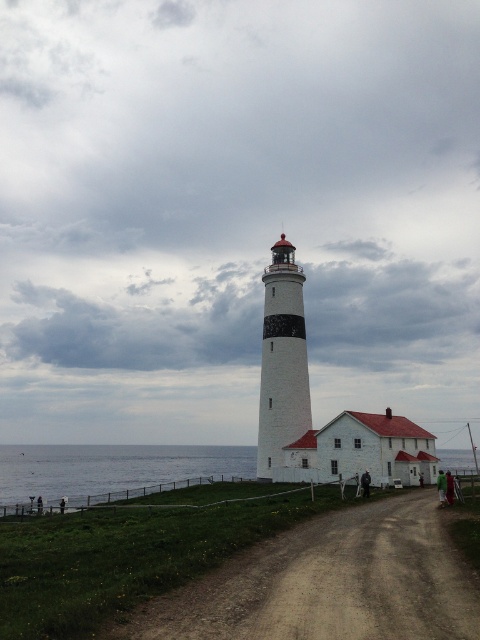
You are standing at the dirt path near the lighthouse and the small white building with a red roof. You want to reach the blue water at lower left. Which direction should you walk to get there?

The blue water at lower left is located at point (109, 467), so you should walk towards the lower left direction to reach it.

You are standing at the edge of the dirt path and want to reach the blue water at lower left without walking through the dirt path. Can you go around the white painted brick lighthouse at center to get there?

The blue water at lower left is positioned on the left side of white painted brick lighthouse at center, so you can go around the lighthouse to reach it without using the dirt path.